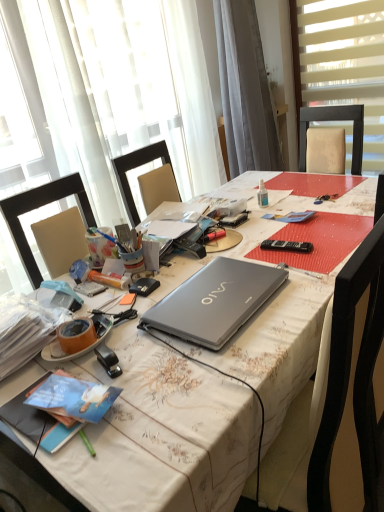
You are a GUI agent. You are given a task and a screenshot of the screen. Output one action in this format:
    pyautogui.click(x=<x>, y=<y>)
    Task: Click on the free space in front of matte plastic pencil at center-left
    
    Given the screenshot: What is the action you would take?
    pyautogui.click(x=113, y=301)